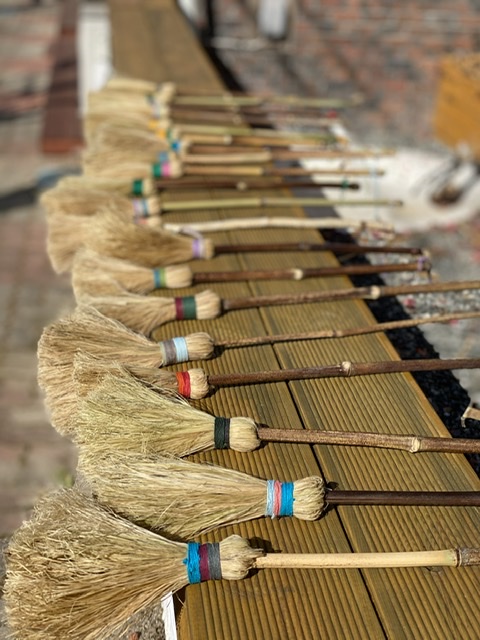
At what (x,y) coordinates should I click in order to perform the action: click on box. Please return your answer as a coordinate pair (x, y). This screenshot has width=480, height=640. Looking at the image, I should click on (456, 97).